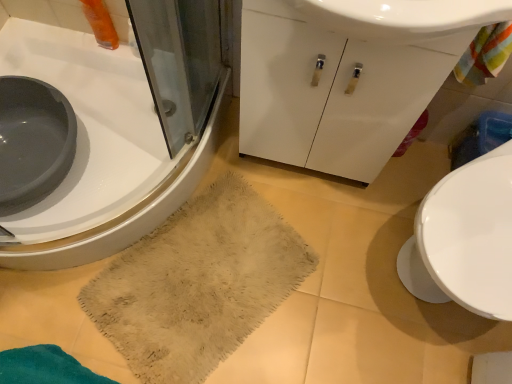
Question: Would you say beige fuzzy rug at lower center is inside or outside white glossy sink at lower left?

Choices:
 (A) inside
 (B) outside

Answer: (B)

Question: From the image's perspective, is beige fuzzy rug at lower center positioned above or below white glossy sink at lower left?

Choices:
 (A) above
 (B) below

Answer: (B)

Question: Which is farther from the beige fuzzy rug at lower center?

Choices:
 (A) white glossy cabinet at center
 (B) white glossy sink at lower left

Answer: (A)

Question: Estimate the real-world distances between objects in this image. Which object is farther from the white glossy cabinet at center?

Choices:
 (A) white glossy sink at lower left
 (B) beige fuzzy rug at lower center

Answer: (A)